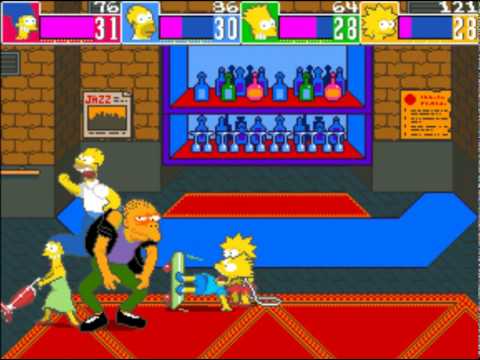
Locate an element on the screen. Image resolution: width=480 pixels, height=360 pixels. alcohol bottles is located at coordinates (256, 91).